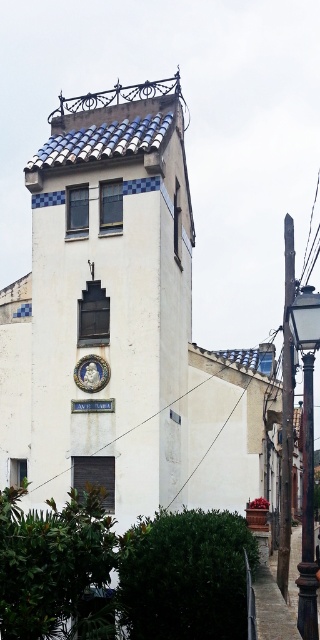
You are standing in front of the white building with the tall tower. There is a point marked at coordinates (185, 576). Based on the scene description, where is this point located?

The point at (185, 576) is located on the green leafy hedge at lower center.